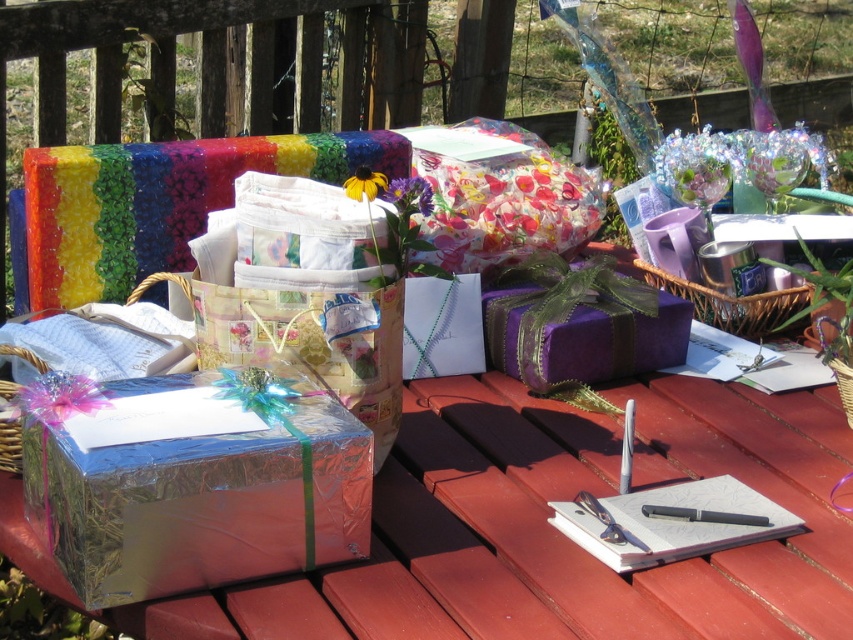
You are setting up a picnic and need to place both the woven brown basket at center and the black matte flower at center on the picnic table. Given their sizes, which object should you place first to ensure both fit comfortably?

The woven brown basket at center is wider than the black matte flower at center, so place the basket first to accommodate its larger width before positioning the flower.

You are organizing a picnic and need to place both the woven brown basket at center and the black matte flower at center on a small shelf. Which object should you place first to ensure both fit?

The woven brown basket at center is bigger than the black matte flower at center, so you should place the woven brown basket at center first to ensure both fit on the shelf.